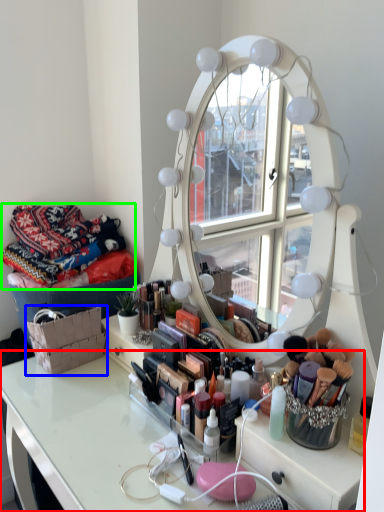
Question: Which is farther away from table (highlighted by a red box)? basket (highlighted by a blue box) or material (highlighted by a green box)?

Choices:
 (A) basket
 (B) material

Answer: (B)